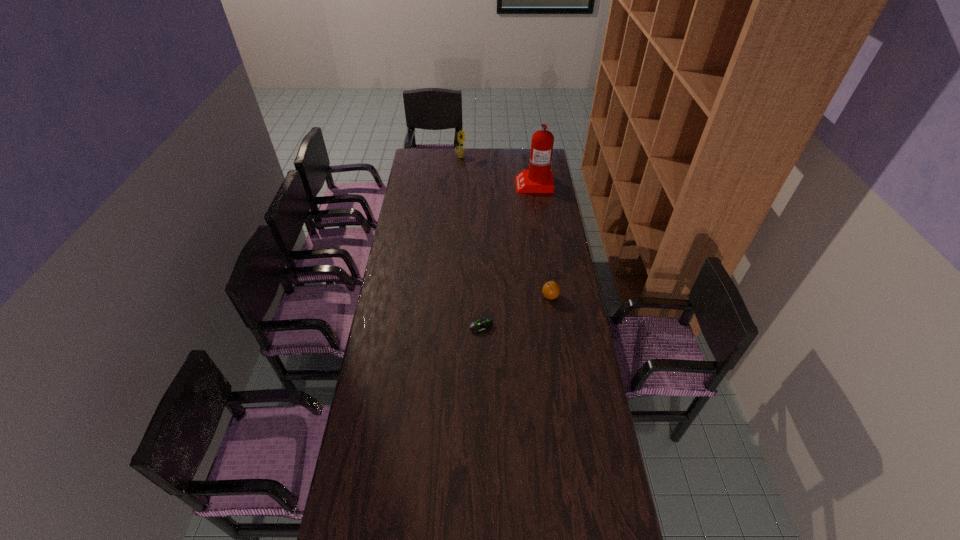
Identify which object is located as the second nearest to the third farthest object. Please provide its 2D coordinates. Your answer should be formatted as a tuple, i.e. [(x, y)], where the tuple contains the x and y coordinates of a point satisfying the conditions above.

[(538, 178)]

Identify which object is located as the nearest to the second shortest object. Please provide its 2D coordinates. Your answer should be formatted as a tuple, i.e. [(x, y)], where the tuple contains the x and y coordinates of a point satisfying the conditions above.

[(480, 326)]

I want to click on vacant area in the image that satisfies the following two spatial constraints: 1. on the front-facing side of the third nearest object; 2. on the front side of the second shortest object, so click(x=550, y=296).

You are a GUI agent. You are given a task and a screenshot of the screen. Output one action in this format:
    pyautogui.click(x=<x>, y=<y>)
    Task: Click on the vacant region that satisfies the following two spatial constraints: 1. on the back side of the third tallest object; 2. on the face of the farthest object
    
    Given the screenshot: What is the action you would take?
    pyautogui.click(x=530, y=157)

You are a GUI agent. You are given a task and a screenshot of the screen. Output one action in this format:
    pyautogui.click(x=<x>, y=<y>)
    Task: Click on the free space that satisfies the following two spatial constraints: 1. on the back side of the second shortest object; 2. on the left side of the second object from left to right
    This screenshot has height=540, width=960.
    Given the screenshot: What is the action you would take?
    pyautogui.click(x=481, y=296)

Where is `vacant space that satisfies the following two spatial constraints: 1. on the face of the second object from left to right; 2. on the right side of the second tallest object`? This screenshot has height=540, width=960. vacant space that satisfies the following two spatial constraints: 1. on the face of the second object from left to right; 2. on the right side of the second tallest object is located at coordinates (451, 327).

The height and width of the screenshot is (540, 960). Find the location of `blank area in the image that satisfies the following two spatial constraints: 1. on the face of the computer mouse; 2. on the right side of the second tallest object`. blank area in the image that satisfies the following two spatial constraints: 1. on the face of the computer mouse; 2. on the right side of the second tallest object is located at coordinates (451, 327).